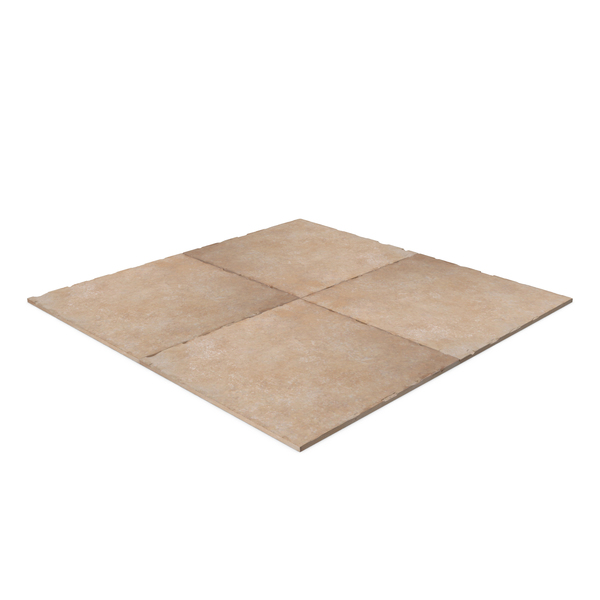
You are a GUI agent. You are given a task and a screenshot of the screen. Output one action in this format:
    pyautogui.click(x=<x>, y=<y>)
    Task: Click on the tile
    The image size is (600, 600).
    Given the screenshot: What is the action you would take?
    pyautogui.click(x=334, y=353)